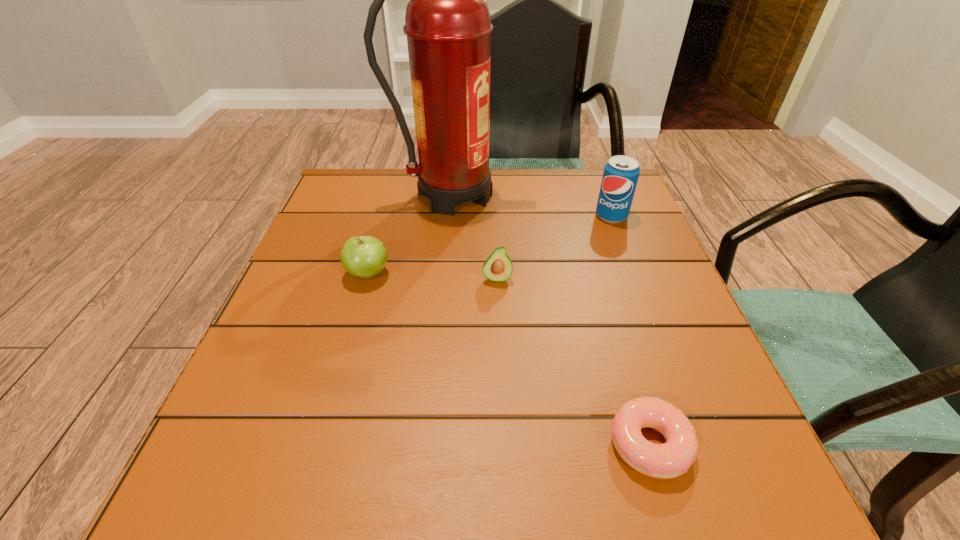
You are a GUI agent. You are given a task and a screenshot of the screen. Output one action in this format:
    pyautogui.click(x=<x>, y=<y>)
    Task: Click on the object present at the near right corner
    The width and height of the screenshot is (960, 540).
    Given the screenshot: What is the action you would take?
    pyautogui.click(x=671, y=459)

The image size is (960, 540). What are the coordinates of `free spot at the far edge of the desktop` in the screenshot? It's located at (407, 170).

Locate an element on the screen. vacant space at the near edge of the desktop is located at coordinates (610, 522).

This screenshot has width=960, height=540. I want to click on free region at the left edge, so pos(315,357).

The width and height of the screenshot is (960, 540). I want to click on vacant space at the right edge, so click(x=612, y=364).

I want to click on vacant area at the far left corner of the desktop, so click(x=365, y=176).

Locate an element on the screen. Image resolution: width=960 pixels, height=540 pixels. vacant space at the near left corner of the desktop is located at coordinates pos(290,501).

Identify the location of free space at the far right corner of the desktop. The height and width of the screenshot is (540, 960). (578, 175).

Image resolution: width=960 pixels, height=540 pixels. What are the coordinates of `free space between the avocado and the fire extinguisher` in the screenshot? It's located at (474, 237).

At what (x,y) coordinates should I click in order to perform the action: click on vacant area that lies between the tallest object and the soda can. Please return your answer as a coordinate pair (x, y). The height and width of the screenshot is (540, 960). Looking at the image, I should click on (531, 206).